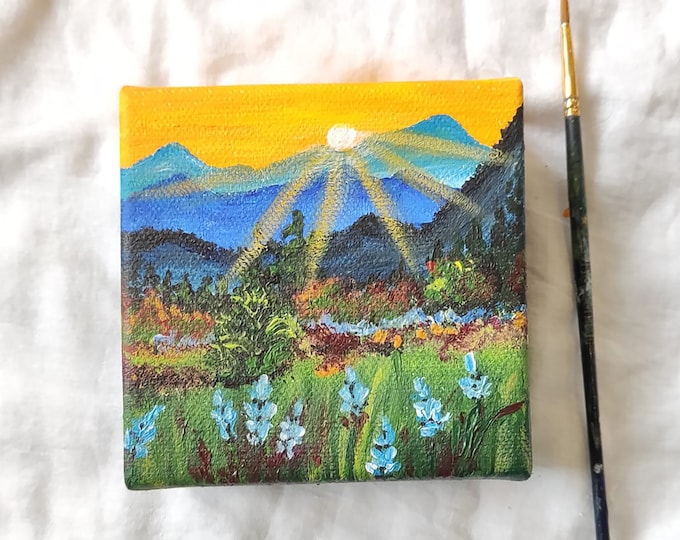
This screenshot has width=680, height=540. Find the location of `handle of paint brush`. handle of paint brush is located at coordinates (583, 335).